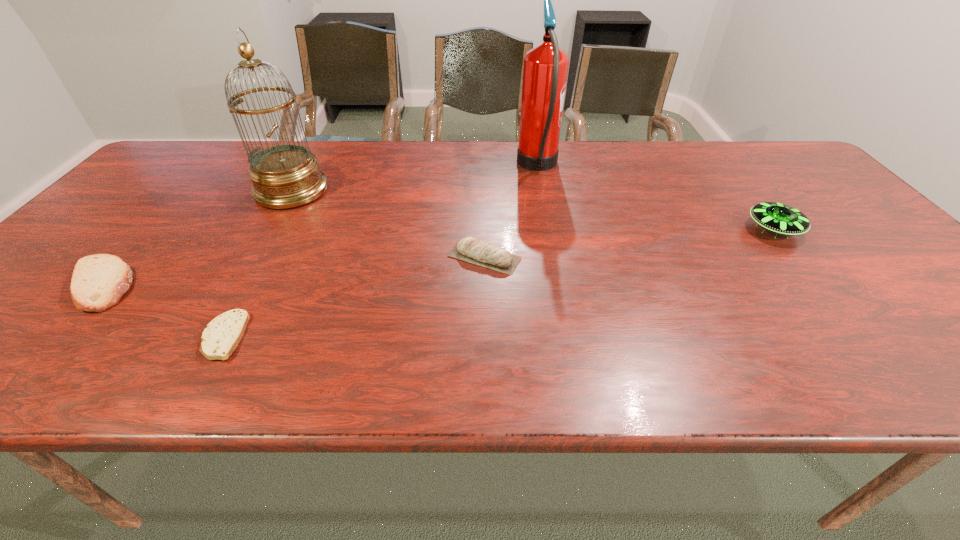
The height and width of the screenshot is (540, 960). In order to click on vacant space positioned with an open door on the birdcage in this screenshot , I will do `click(363, 191)`.

Locate an element on the screen. The height and width of the screenshot is (540, 960). free point located 0.360m on the front of the third tallest object is located at coordinates (887, 369).

This screenshot has width=960, height=540. I want to click on free space located 0.140m on the front of the fourth object from left to right, so click(486, 322).

You are a GUI agent. You are given a task and a screenshot of the screen. Output one action in this format:
    pyautogui.click(x=<x>, y=<y>)
    Task: Click on the free location located 0.130m on the right of the second shortest object
    
    Given the screenshot: What is the action you would take?
    pyautogui.click(x=195, y=285)

The image size is (960, 540). Find the location of `vacant space positioned on the back of the shortest pita bread`. vacant space positioned on the back of the shortest pita bread is located at coordinates (276, 241).

The image size is (960, 540). What are the coordinates of `fire extinguisher positioned at the far edge` in the screenshot? It's located at (545, 70).

Locate an element on the screen. This screenshot has width=960, height=540. birdcage at the far edge is located at coordinates (284, 176).

Where is `object at the near edge`? This screenshot has height=540, width=960. object at the near edge is located at coordinates (221, 336).

Locate an element on the screen. Image resolution: width=960 pixels, height=540 pixels. object at the left edge is located at coordinates (98, 282).

Locate an element on the screen. Image resolution: width=960 pixels, height=540 pixels. vacant space at the far edge of the desktop is located at coordinates pyautogui.click(x=362, y=161).